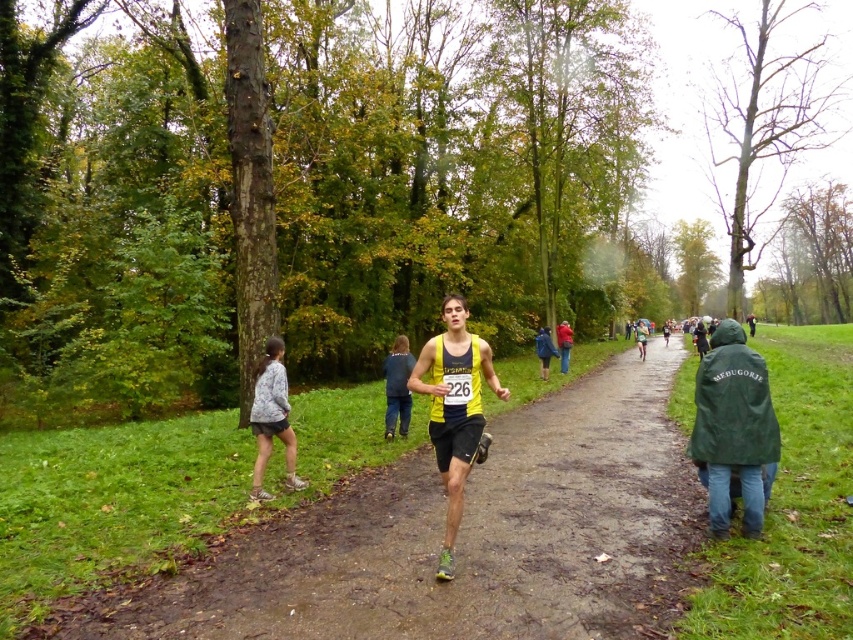
Between yellow fabric runner at center and green matte jacket at lower right, which one is positioned lower?

yellow fabric runner at center is below.

The height and width of the screenshot is (640, 853). What do you see at coordinates (466, 538) in the screenshot?
I see `yellow fabric runner at center` at bounding box center [466, 538].

Find the location of a particular element. The width and height of the screenshot is (853, 640). yellow fabric runner at center is located at coordinates (466, 538).

Find the location of a particular element. This screenshot has height=640, width=853. yellow fabric runner at center is located at coordinates (466, 538).

Which of these two, yellow matte running shirt at center or red fabric jacket at center, stands taller?

yellow matte running shirt at center

Is point (442, 333) positioned behind point (561, 353)?

No, it is in front of (561, 353).

Who is more distant from viewer, [447,476] or [561,371]?

The point [561,371] is behind.

Locate an element on the screen. This screenshot has height=640, width=853. yellow matte running shirt at center is located at coordinates 454,408.

Who is more distant from viewer, (611, 452) or (447, 324)?

Positioned behind is point (611, 452).

Between yellow fabric runner at center and yellow matte running shirt at center, which one is positioned higher?

yellow matte running shirt at center

Which is behind, point (648, 440) or point (457, 476)?

Positioned behind is point (648, 440).

Image resolution: width=853 pixels, height=640 pixels. Identify the location of yellow fabric runner at center. (466, 538).